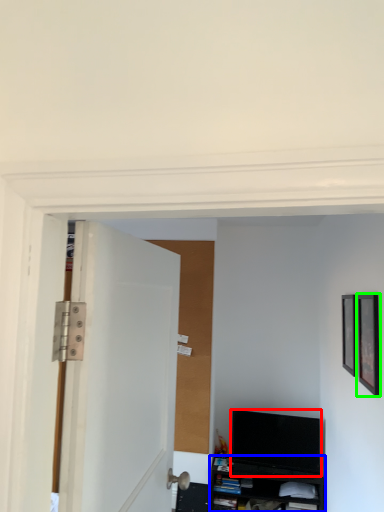
Question: Based on their relative distances, which object is farther from television (highlighted by a red box)? Choose from cabinetry (highlighted by a blue box) and picture frame (highlighted by a green box).

Choices:
 (A) cabinetry
 (B) picture frame

Answer: (B)